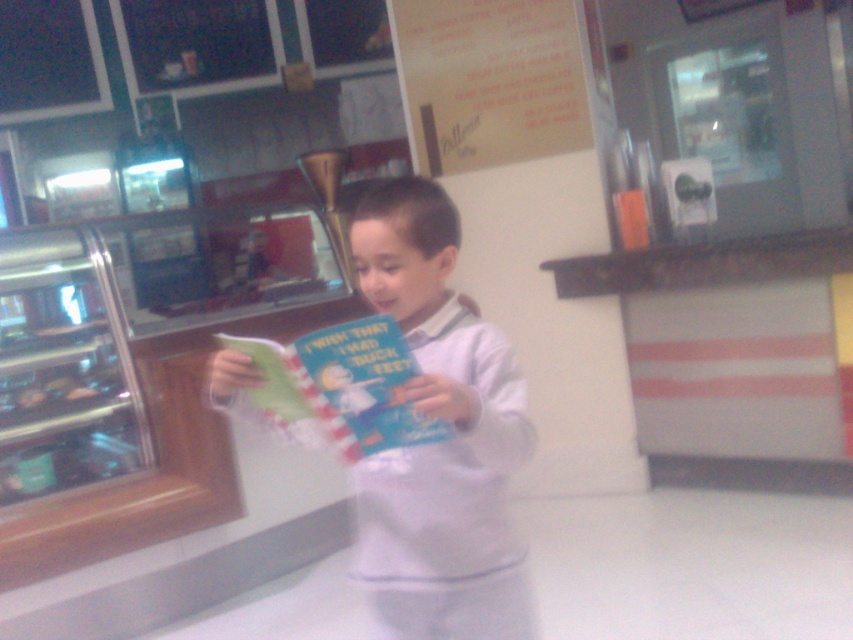
You are a customer in the cafe and want to read the menu on the wooden signboard at upper center. However, the green paper book at center is blocking your view. Can you move the book to see the menu?

The green paper book at center is behind the wooden signboard at upper center, so it is not blocking the view of the menu. You can see the menu without moving the book.

The boy is wearing a white matte shirt at center and holding a green paper book at center. Which item is positioned more to the left?

The green paper book at center is positioned more to the left than the white matte shirt at center.

What is located at the coordinates point (439, 442)?

The white matte shirt at center is located at point (439, 442).